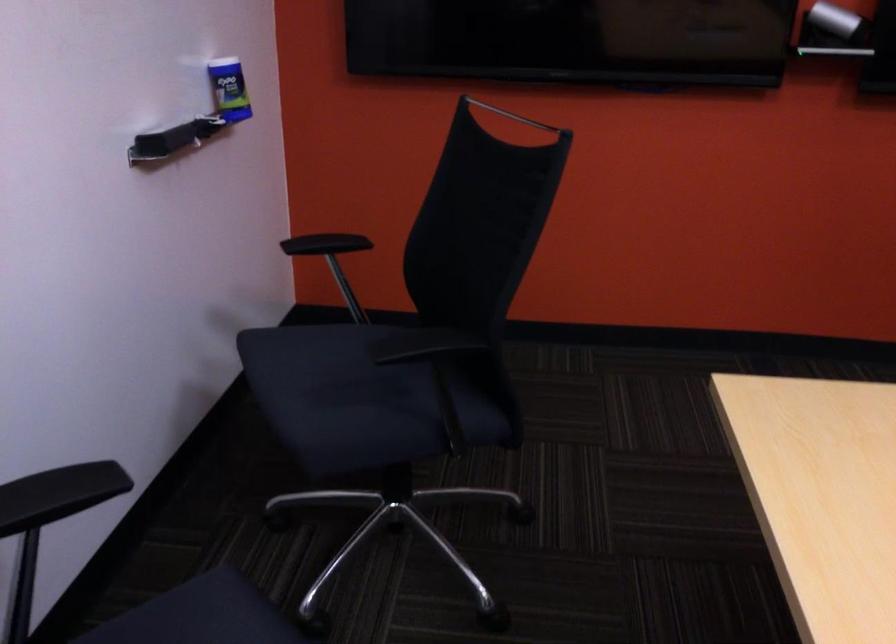
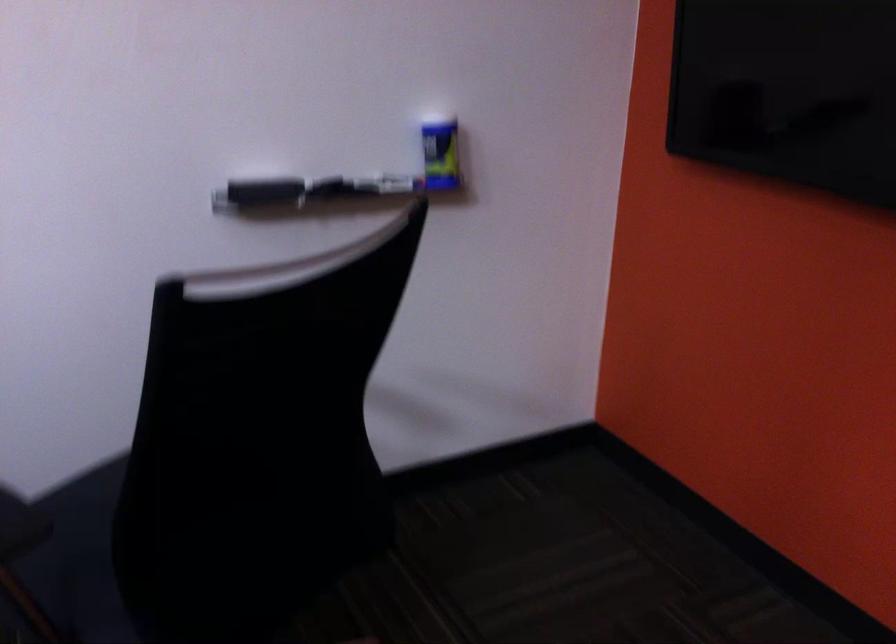
The point at (246, 91) is marked in the first image. Where is the corresponding point in the second image?

(440, 156)